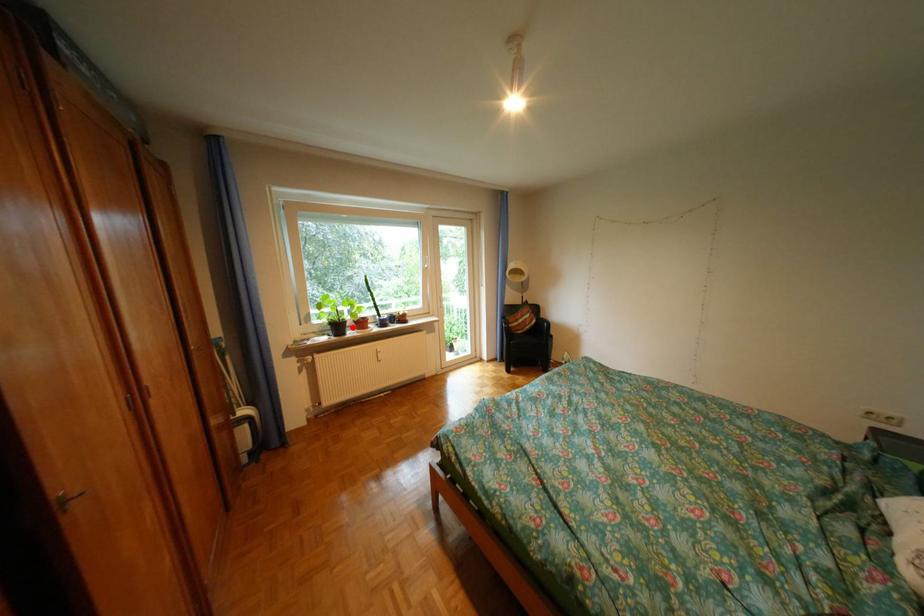
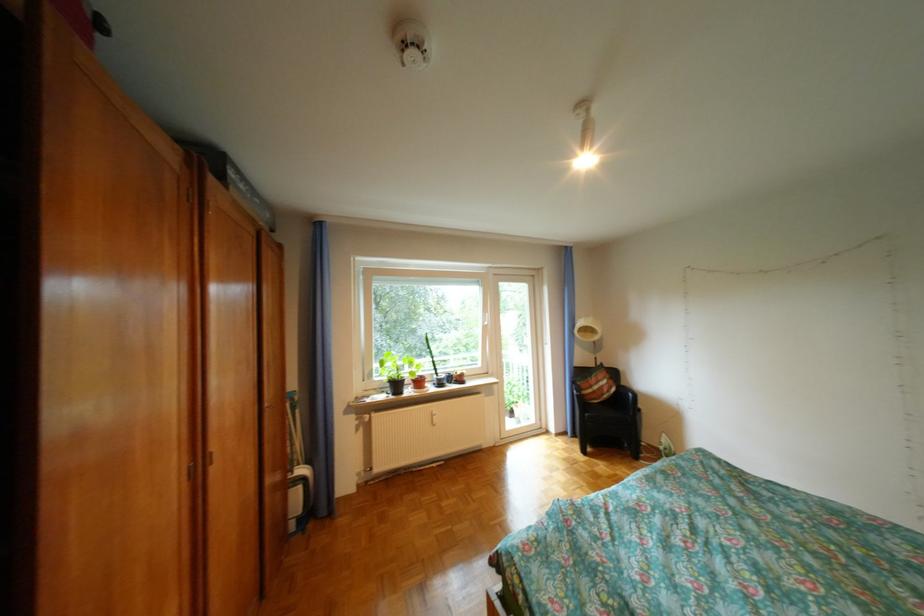
Find the pixel in the second image that matches the highlighted location in the first image.

(410, 386)